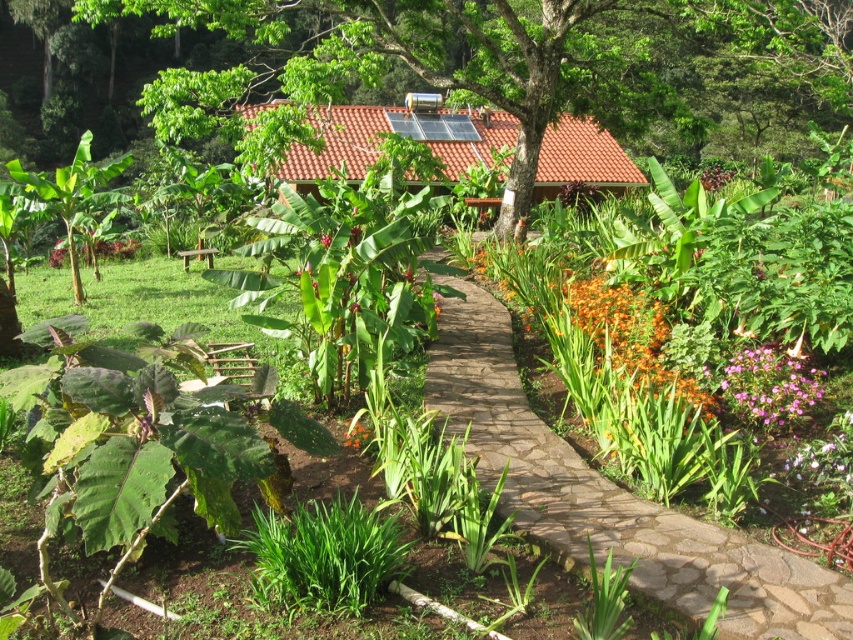
Which is in front, point (727, 384) or point (350, 429)?

Point (350, 429)

Does point (769, 390) come closer to viewer compared to point (369, 428)?

No, (769, 390) is behind (369, 428).

Where is `pink matte flower at right`? Image resolution: width=853 pixels, height=640 pixels. pink matte flower at right is located at coordinates (769, 387).

Who is positioned more to the right, brown stone path at center or pink matte flower at right?

From the viewer's perspective, pink matte flower at right appears more on the right side.

Is brown stone path at center bigger than pink matte flower at right?

No, brown stone path at center is not bigger than pink matte flower at right.

Who is more distant from viewer, (704, 545) or (740, 410)?

The point (740, 410) is more distant.

At what (x,y) coordinates should I click in order to perform the action: click on brown stone path at center. Please return your answer as a coordinate pair (x, y). This screenshot has height=640, width=853. Looking at the image, I should click on (611, 497).

This screenshot has width=853, height=640. Find the location of `brown tile roof at center`. brown tile roof at center is located at coordinates (399, 132).

Does brown tile roof at center have a larger size compared to orange matte flower at center?

Yes, brown tile roof at center is bigger than orange matte flower at center.

Is point (421, 124) positioned behind point (361, 440)?

That is True.

Identify the location of brown tile roof at center. This screenshot has width=853, height=640. (399, 132).